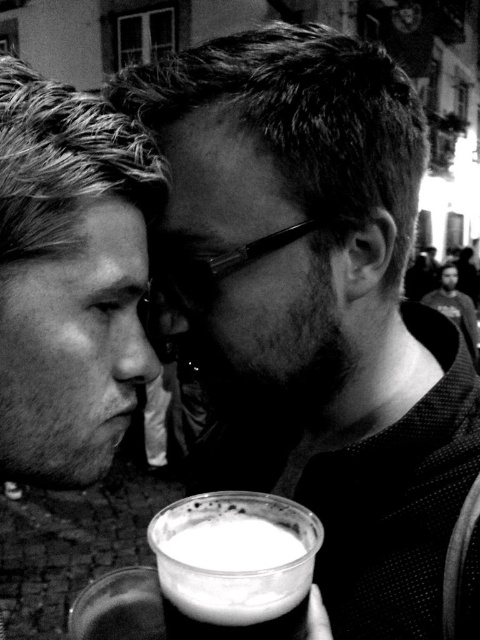
Question: Does smooth skin face at left appear on the left side of white frothy liquid at lower center?

Choices:
 (A) no
 (B) yes

Answer: (B)

Question: Does smooth skin face at left have a lesser width compared to white frothy liquid at lower center?

Choices:
 (A) yes
 (B) no

Answer: (B)

Question: Can you confirm if smooth skin face at left is bigger than white frothy liquid at lower center?

Choices:
 (A) yes
 (B) no

Answer: (A)